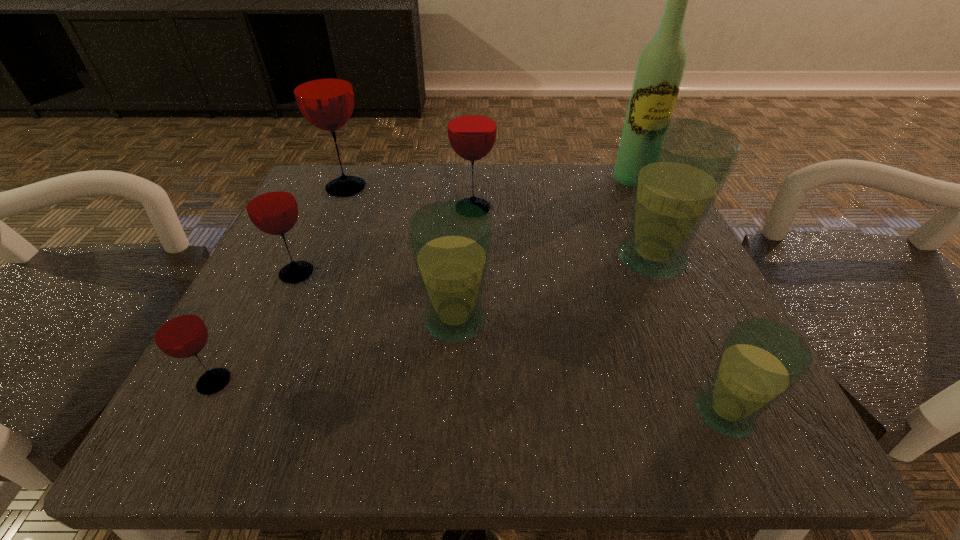
Locate an element on the screen. The image size is (960, 540). free space at the far right corner of the desktop is located at coordinates (615, 207).

Identify the location of free spot between the nearest blue glass and the farthest blue glass. This screenshot has width=960, height=540. (687, 336).

Locate an element on the screen. This screenshot has width=960, height=540. unoccupied position between the biggest blue glass and the nearest blue glass is located at coordinates (687, 336).

At what (x,y) coordinates should I click in order to perform the action: click on free space between the smallest blue glass and the third nearest object. Please return your answer as a coordinate pair (x, y). The height and width of the screenshot is (540, 960). Looking at the image, I should click on (589, 367).

The height and width of the screenshot is (540, 960). What are the coordinates of `empty location between the biggest red glass and the smallest red glass` in the screenshot? It's located at coord(280,285).

The image size is (960, 540). Find the location of `free space between the biggest red glass and the smallest blue glass`. free space between the biggest red glass and the smallest blue glass is located at coordinates (536, 301).

Locate an element on the screen. This screenshot has height=540, width=960. unoccupied area between the nearest blue glass and the tallest glass is located at coordinates (536, 301).

Image resolution: width=960 pixels, height=540 pixels. In order to click on empty space between the biggest blue glass and the tallest glass in this screenshot , I will do `click(498, 224)`.

I want to click on unoccupied position between the third farthest red glass and the smallest red glass, so click(255, 328).

Find the location of a particular element. free spot between the tallest object and the nearest blue glass is located at coordinates (678, 296).